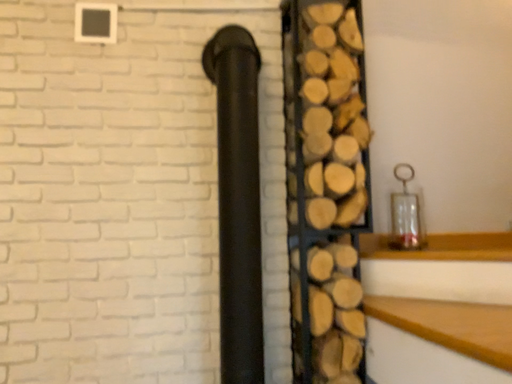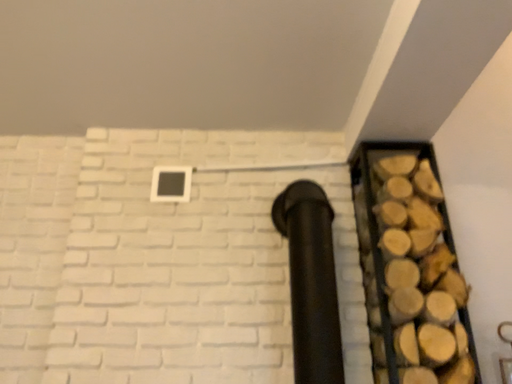
Question: Which way did the camera rotate in the video?

Choices:
 (A) rotated upward
 (B) rotated downward

Answer: (A)